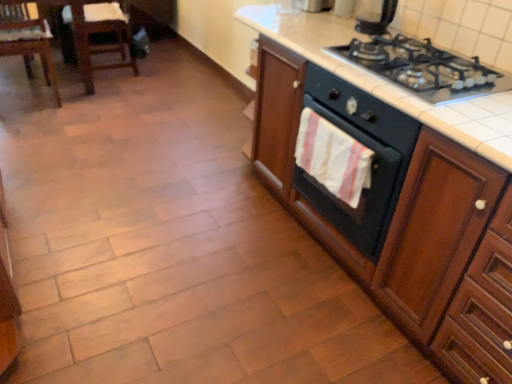
You are a GUI agent. You are given a task and a screenshot of the screen. Output one action in this format:
    pyautogui.click(x=<x>, y=<y>)
    Task: Click on the black glossy kettle at upper right
    
    Given the screenshot: What is the action you would take?
    pyautogui.click(x=376, y=19)

Identify the location of black matte oven at center-right. (372, 161).

Image resolution: width=512 pixels, height=384 pixels. I want to click on black glossy kettle at upper right, so click(376, 19).

Is white cotton hand towel at center-right taller than black matte oven at center-right?

In fact, white cotton hand towel at center-right may be shorter than black matte oven at center-right.

Looking at their sizes, would you say white cotton hand towel at center-right is wider or thinner than black matte oven at center-right?

Considering their sizes, white cotton hand towel at center-right looks slimmer than black matte oven at center-right.

Is white cotton hand towel at center-right turned away from black matte oven at center-right?

Absolutely, white cotton hand towel at center-right is directed away from black matte oven at center-right.

At what (x,y) coordinates should I click in order to perform the action: click on hand towel above the wooden cabinet at right (from a real-world perspective). Please return your answer as a coordinate pair (x, y). Looking at the image, I should click on (333, 157).

Does wooden cabinet at right have a greater height compared to white cotton hand towel at center-right?

Yes.

Considering the sizes of objects wooden cabinet at right and white cotton hand towel at center-right in the image provided, who is wider, wooden cabinet at right or white cotton hand towel at center-right?

Wider between the two is wooden cabinet at right.

From the image's perspective, which one is positioned higher, wooden cabinet at right or white cotton hand towel at center-right?

wooden cabinet at right.

Is black glossy kettle at upper right smaller than wooden cabinet at right?

Indeed, black glossy kettle at upper right has a smaller size compared to wooden cabinet at right.

Considering the positions of objects black glossy kettle at upper right and wooden cabinet at right in the image provided, who is more to the left, black glossy kettle at upper right or wooden cabinet at right?

wooden cabinet at right.

In the scene shown: Could you tell me if black glossy kettle at upper right is turned towards wooden cabinet at right?

No, black glossy kettle at upper right is not facing towards wooden cabinet at right.

Which of these two, black glossy kettle at upper right or wooden cabinet at right, is wider?

With larger width is wooden cabinet at right.

Can you tell me how much white cotton hand towel at center-right and wooden cabinet at right differ in facing direction?

The angle between the facing direction of white cotton hand towel at center-right and the facing direction of wooden cabinet at right is 0.00202 degrees.

Is point (315, 139) positioned behind point (423, 276)?

That is True.

Which of these two, white cotton hand towel at center-right or wooden cabinet at right, is wider?

With larger width is wooden cabinet at right.

Is white cotton hand towel at center-right spatially inside wooden cabinet at right, or outside of it?

white cotton hand towel at center-right is not inside wooden cabinet at right, it's outside.

From the image's perspective, which one is positioned higher, black matte oven at center-right or wooden cabinet at right?

wooden cabinet at right, from the image's perspective.

Which of these two, black matte oven at center-right or wooden cabinet at right, stands taller?

wooden cabinet at right is taller.

Are black matte oven at center-right and wooden cabinet at right located far from each other?

No, there isn't a large distance between black matte oven at center-right and wooden cabinet at right.

Considering the positions of points (338, 121) and (397, 88), is point (338, 121) farther from camera compared to point (397, 88)?

Yes.

Would you say wooden chair at left is inside or outside black glossy kettle at upper right?

wooden chair at left is outside black glossy kettle at upper right.

Between wooden chair at left and black glossy kettle at upper right, which one has less height?

Standing shorter between the two is black glossy kettle at upper right.

Does point (89, 14) come behind point (387, 23)?

Yes.

Is wooden chair at left not close to black glossy kettle at upper right?

Yes.

How far apart are white cotton hand towel at center-right and black glossy kettle at upper right?

white cotton hand towel at center-right and black glossy kettle at upper right are 25.71 inches apart from each other.

Is white cotton hand towel at center-right wider than black glossy kettle at upper right?

Incorrect, the width of white cotton hand towel at center-right does not surpass that of black glossy kettle at upper right.

Considering the relative sizes of white cotton hand towel at center-right and black glossy kettle at upper right in the image provided, is white cotton hand towel at center-right smaller than black glossy kettle at upper right?

Actually, white cotton hand towel at center-right might be larger than black glossy kettle at upper right.

Is black glossy kettle at upper right inside white cotton hand towel at center-right?

No, black glossy kettle at upper right is not inside white cotton hand towel at center-right.

Locate an element on the screen. This screenshot has height=384, width=512. oven located underneath the white cotton hand towel at center-right (from a real-world perspective) is located at coordinates (372, 161).

In order to click on hand towel located on the left of wooden cabinet at right in this screenshot , I will do `click(333, 157)`.

Estimate the real-world distances between objects in this image. Which object is closer to white cotton hand towel at center-right, black glossy kettle at upper right or wooden chair at left?

black glossy kettle at upper right is positioned closer to the anchor white cotton hand towel at center-right.

Which object lies nearer to the anchor point black glossy kettle at upper right, black matte oven at center-right or black glass gas stove at upper right?

black glass gas stove at upper right is positioned closer to the anchor black glossy kettle at upper right.

From the image, which object appears to be farther from white cotton hand towel at center-right, black glossy kettle at upper right or black matte oven at center-right?

black glossy kettle at upper right is further to white cotton hand towel at center-right.

Which object lies further to the anchor point black glass gas stove at upper right, white cotton hand towel at center-right or wooden cabinet at right?

white cotton hand towel at center-right.

Which object lies nearer to the anchor point black glass gas stove at upper right, wooden chair at left or black matte oven at center-right?

black matte oven at center-right is positioned closer to the anchor black glass gas stove at upper right.

Looking at the image, which one is located further to white cotton hand towel at center-right, wooden cabinet at right or wooden chair at left?

wooden chair at left is positioned further to the anchor white cotton hand towel at center-right.

From the image, which object appears to be farther from white cotton hand towel at center-right, black matte oven at center-right or black glossy kettle at upper right?

black glossy kettle at upper right lies further to white cotton hand towel at center-right than the other object.

Based on their spatial positions, is white cotton hand towel at center-right or black matte oven at center-right closer to wooden chair at left?

Based on the image, white cotton hand towel at center-right appears to be nearer to wooden chair at left.

At what (x,y) coordinates should I click in order to perform the action: click on kitchen appliance positioned between wooden cabinet at right and wooden chair at left from near to far. Please return your answer as a coordinate pair (x, y). The width and height of the screenshot is (512, 384). Looking at the image, I should click on (376, 19).

I want to click on hand towel between wooden chair at left and black glossy kettle at upper right in the horizontal direction, so click(333, 157).

Where is `gas stove between black glossy kettle at upper right and black matte oven at center-right from top to bottom`? Image resolution: width=512 pixels, height=384 pixels. gas stove between black glossy kettle at upper right and black matte oven at center-right from top to bottom is located at coordinates (423, 68).

Identify the location of gas stove positioned between wooden cabinet at right and wooden chair at left from near to far. This screenshot has width=512, height=384. (423, 68).